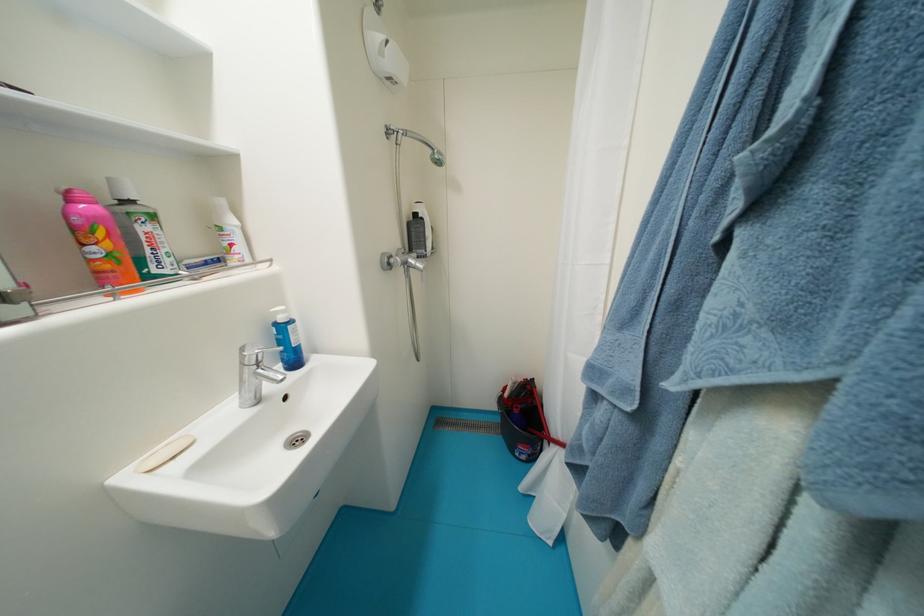
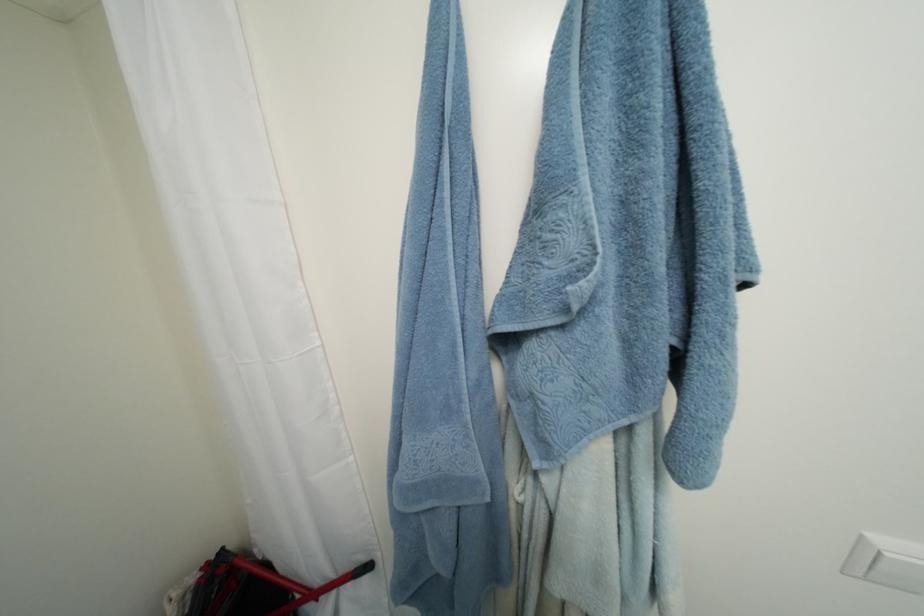
Question: The camera is either moving clockwise (left) or counter-clockwise (right) around the object. The first image is from the beginning of the video and the second image is from the end. Is the camera moving left or right when shooting the video?

Choices:
 (A) Left
 (B) Right

Answer: (A)